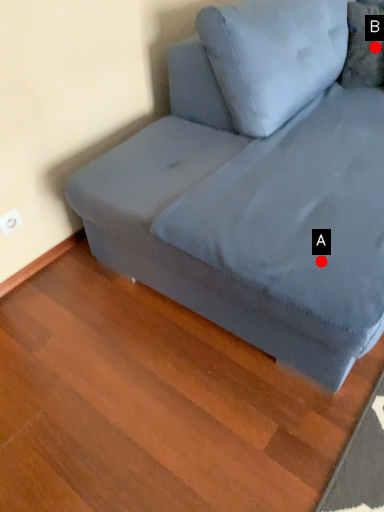
Question: Two points are circled on the image, labeled by A and B beside each circle. Which point is closer to the camera taking this photo?

Choices:
 (A) A is closer
 (B) B is closer

Answer: (A)